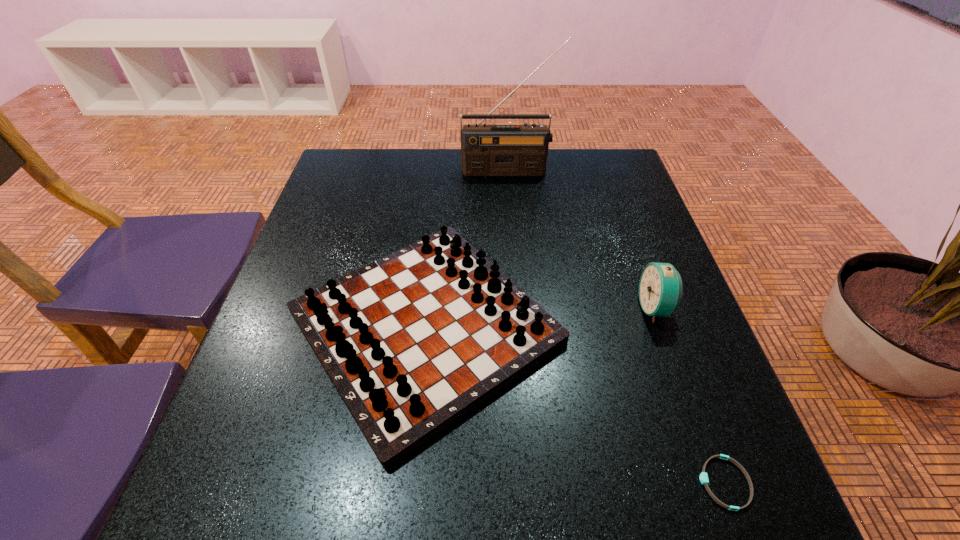
Image resolution: width=960 pixels, height=540 pixels. In order to click on vacant area that lies between the tallest object and the alarm clock in this screenshot , I will do `click(582, 239)`.

The image size is (960, 540). I want to click on vacant region between the radio receiver and the wristband, so click(x=616, y=327).

Identify which object is located as the second nearest to the wristband. Please provide its 2D coordinates. Your answer should be formatted as a tuple, i.e. [(x, y)], where the tuple contains the x and y coordinates of a point satisfying the conditions above.

[(660, 289)]

In order to click on object that is the second closest to the alarm clock in this screenshot , I will do `click(704, 480)`.